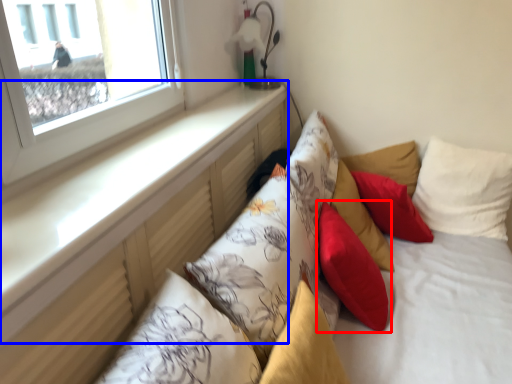
Question: Which of the following is the closest to the observer, pillow (highlighted by a red box) or window sill (highlighted by a blue box)?

Choices:
 (A) pillow
 (B) window sill

Answer: (B)